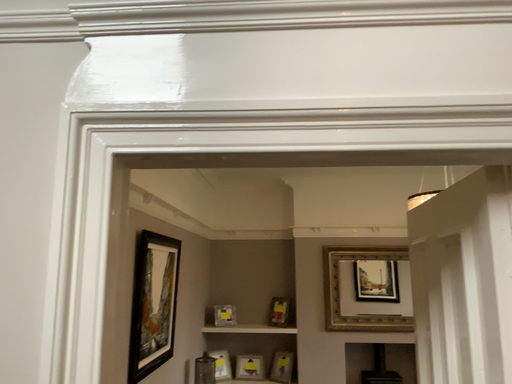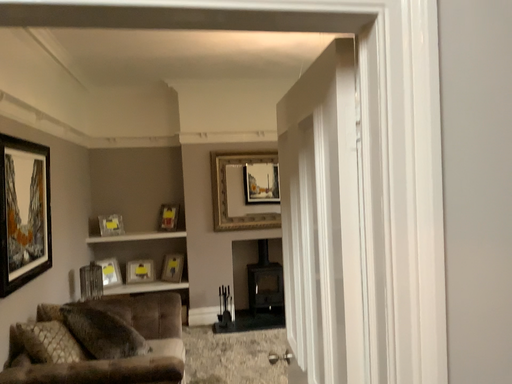
Question: Which way did the camera rotate in the video?

Choices:
 (A) rotated upward
 (B) rotated downward

Answer: (B)